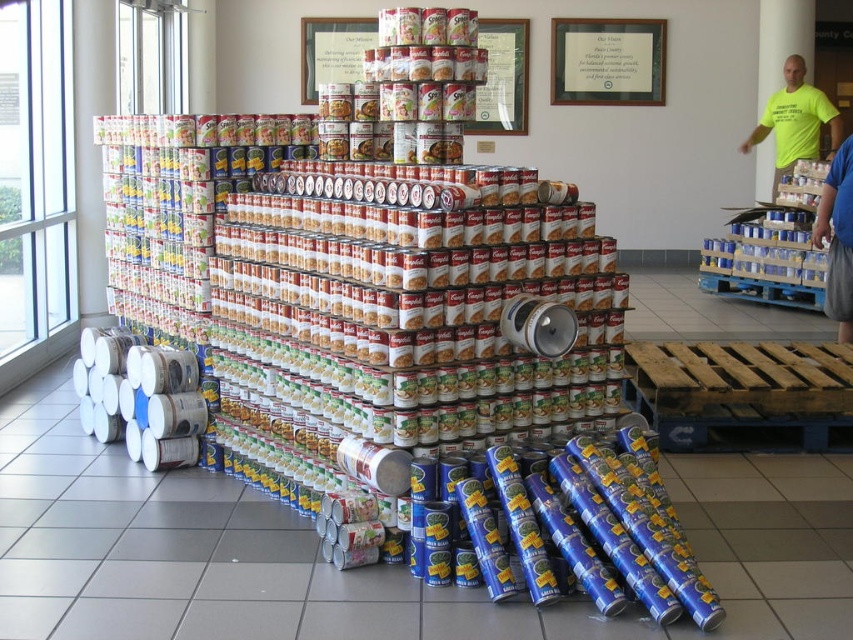
Which of these two, neon yellow t-shirt at upper right or blue shirt at lower right, stands taller?

Standing taller between the two is neon yellow t-shirt at upper right.

Between neon yellow t-shirt at upper right and blue shirt at lower right, which one appears on the right side from the viewer's perspective?

neon yellow t-shirt at upper right is more to the right.

Who is more distant from viewer, (772, 129) or (833, 230)?

Point (772, 129)

The image size is (853, 640). Identify the location of neon yellow t-shirt at upper right. (795, 120).